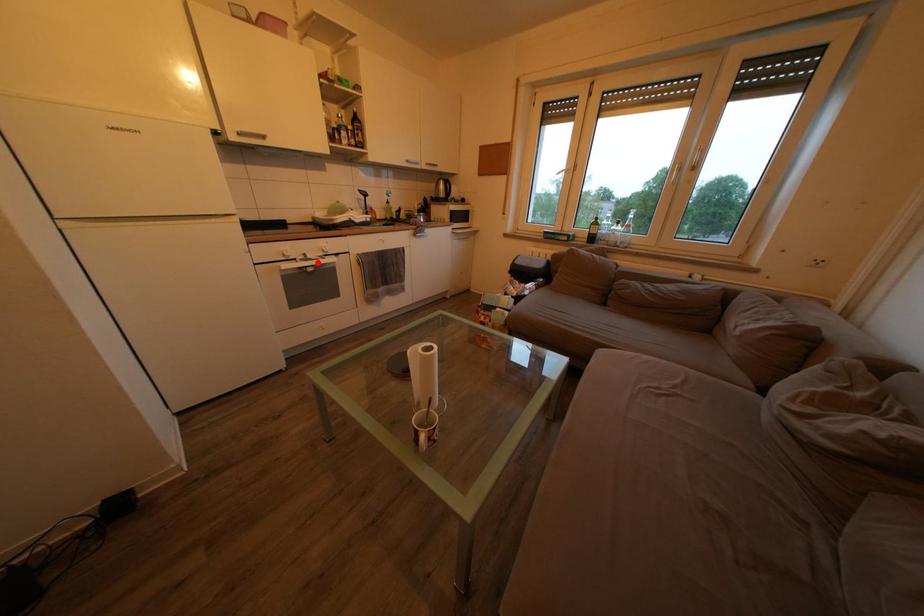
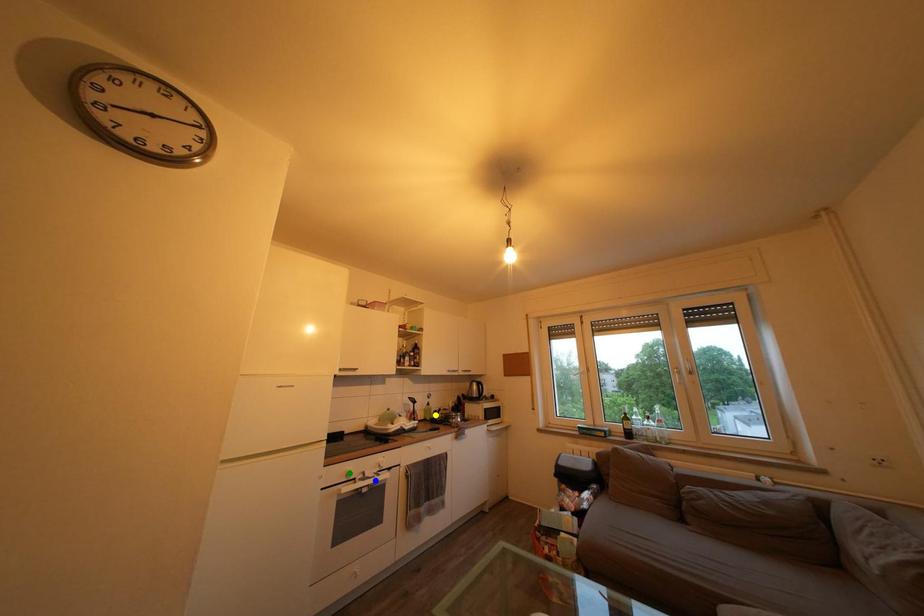
Question: I am providing you with two images of the same scene from different viewpoints. A red point is marked on the first image. You are given multiple points on the second image. Which spot in image 2 lines up with the point in image 1?

Choices:
 (A) blue point
 (B) yellow point
 (C) green point

Answer: (A)